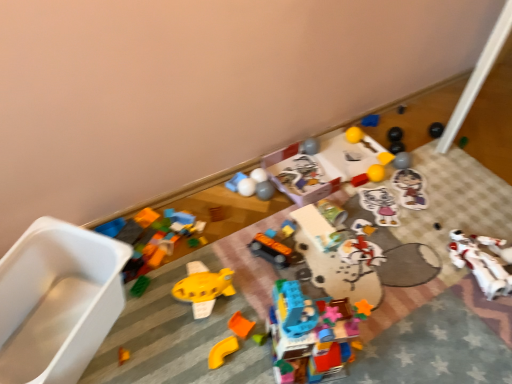
Locate an element on the screen. The width and height of the screenshot is (512, 384). empty space that is in between orange matte plastic toy at lower center, the third toy when ordered from left to right, and matte black car at center, the eighth toy positioned from the left is located at coordinates (246, 300).